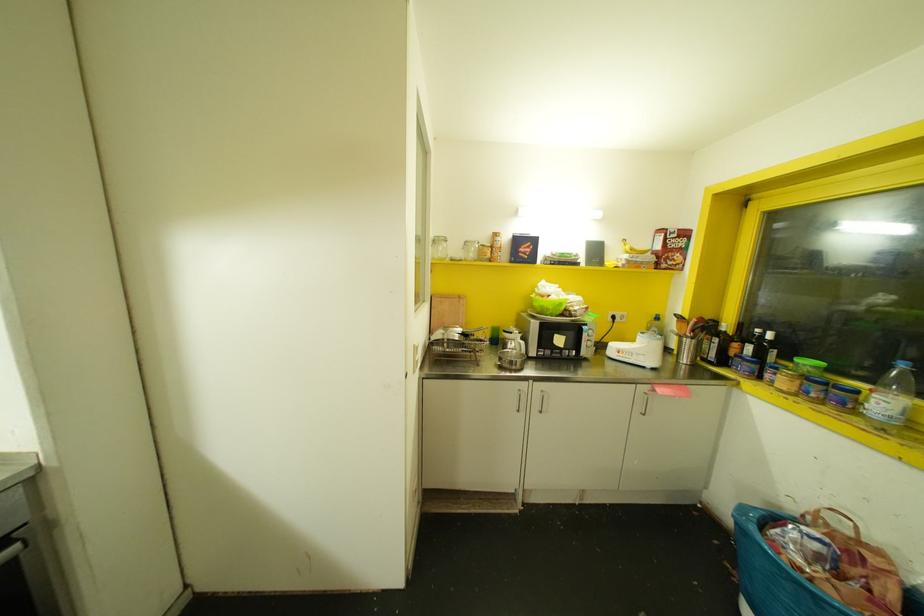
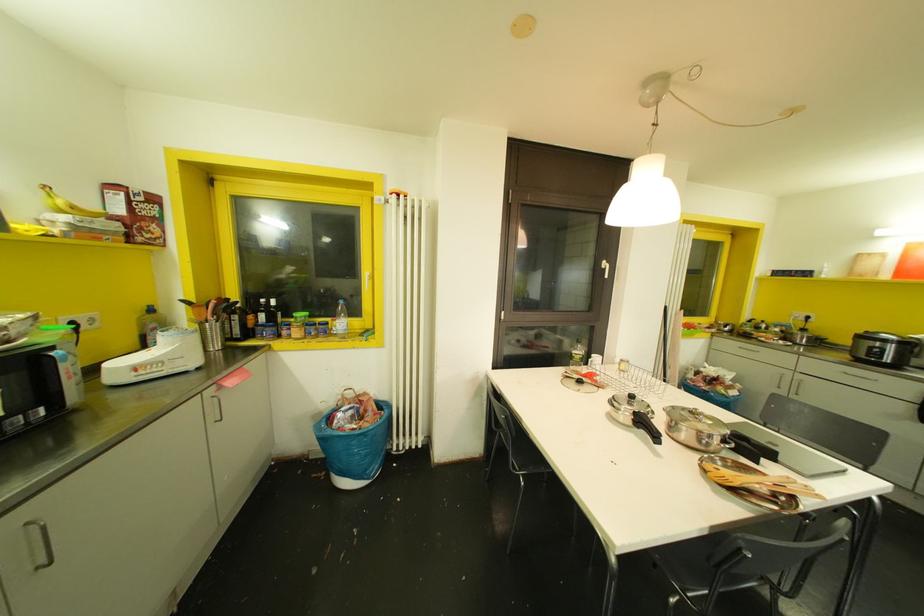
Question: The images are taken continuously from a first-person perspective. In which direction is your viewpoint rotating?

Choices:
 (A) Left
 (B) Right
 (C) Up
 (D) Down

Answer: (B)